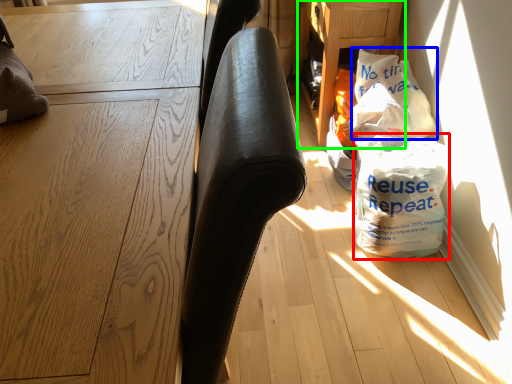
Question: Based on their relative distances, which object is farther from grocery bag (highlighted by a red box)? Choose from grocery bag (highlighted by a blue box) and table (highlighted by a green box).

Choices:
 (A) grocery bag
 (B) table

Answer: (B)